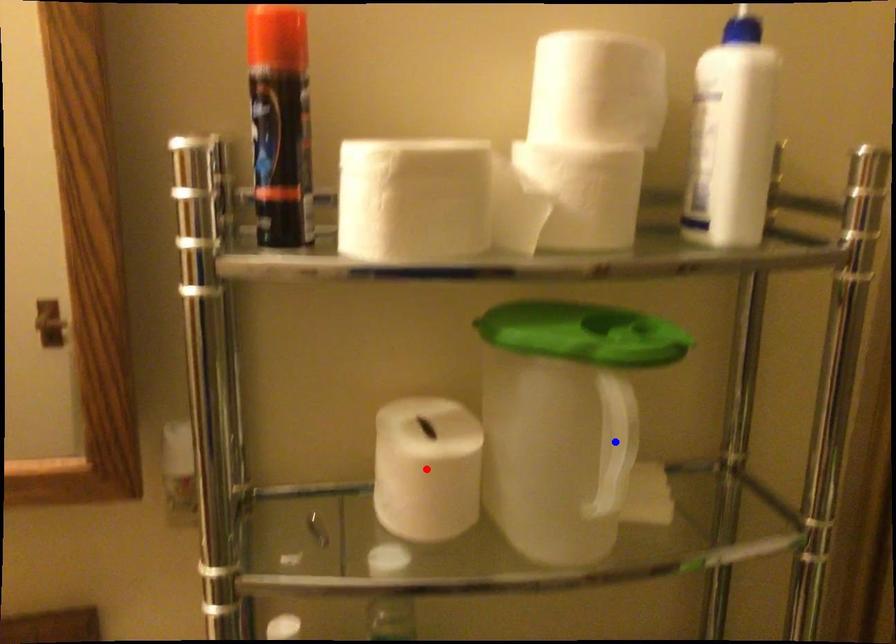
Question: Which of the two points in the image is closer to the camera?

Choices:
 (A) Blue point is closer.
 (B) Red point is closer.

Answer: (A)